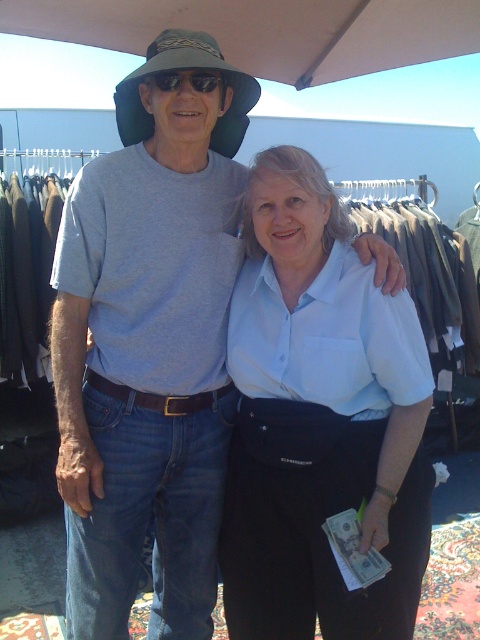
Is white cotton blouse at center above matte black sunglasses at upper center?

No, white cotton blouse at center is not above matte black sunglasses at upper center.

Is white cotton blouse at center wider than matte black sunglasses at upper center?

Correct, the width of white cotton blouse at center exceeds that of matte black sunglasses at upper center.

The image size is (480, 640). Describe the element at coordinates (320, 420) in the screenshot. I see `white cotton blouse at center` at that location.

I want to click on white cotton blouse at center, so click(x=320, y=420).

Between point (300, 346) and point (225, 112), which one is positioned in front?

Positioned in front is point (300, 346).

Based on the photo, can you confirm if white cotton blouse at center is positioned below green fabric hat at upper center?

Indeed, white cotton blouse at center is positioned under green fabric hat at upper center.

Which is behind, point (295, 618) or point (215, 54)?

Positioned behind is point (295, 618).

Identify the location of white cotton blouse at center. The height and width of the screenshot is (640, 480). (320, 420).

Is green fabric hat at upper center taller than matte black sunglasses at upper center?

Yes.

Is green fabric hat at upper center shorter than matte black sunglasses at upper center?

In fact, green fabric hat at upper center may be taller than matte black sunglasses at upper center.

Which is in front, point (131, 120) or point (200, 83)?

Positioned in front is point (200, 83).

What are the coordinates of `green fabric hat at upper center` in the screenshot? It's located at (186, 68).